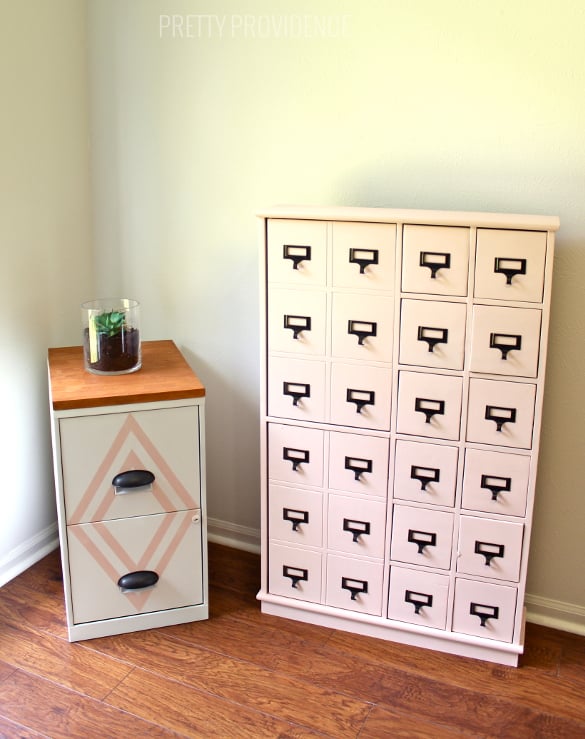
Where is `pattern on small cabinet`? pattern on small cabinet is located at coordinates (166, 548), (156, 542).